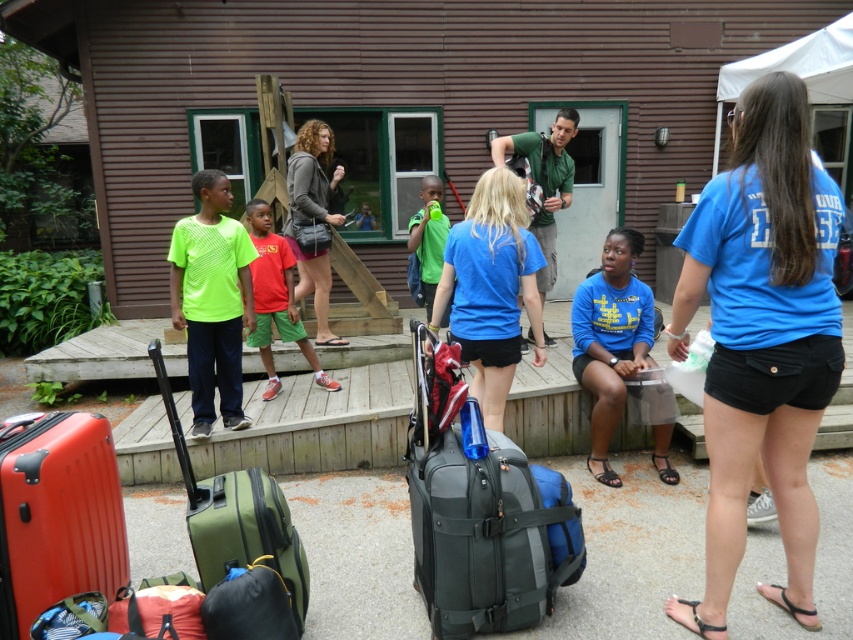
Question: Among these objects, which one is nearest to the camera?

Choices:
 (A) green matte shirt at center
 (B) neon green mesh shirt at center
 (C) blue matte shirt at center

Answer: (C)

Question: Considering the relative positions of gray fabric suitcase at center and blue matte shirt at center in the image provided, where is gray fabric suitcase at center located with respect to blue matte shirt at center?

Choices:
 (A) below
 (B) above

Answer: (A)

Question: Estimate the real-world distances between objects in this image. Which object is closer to the gray fabric suitcase at center?

Choices:
 (A) gray hoodie at center
 (B) green fabric suitcase at lower left

Answer: (B)

Question: Which of the following is the farthest from the observer?

Choices:
 (A) green fabric suitcase at lower left
 (B) blue cotton shirt at lower center

Answer: (B)

Question: Is gray fabric suitcase at center above neon green mesh shirt at center?

Choices:
 (A) no
 (B) yes

Answer: (A)

Question: Does gray fabric suitcase at center appear on the left side of green cotton shirt at center?

Choices:
 (A) no
 (B) yes

Answer: (B)